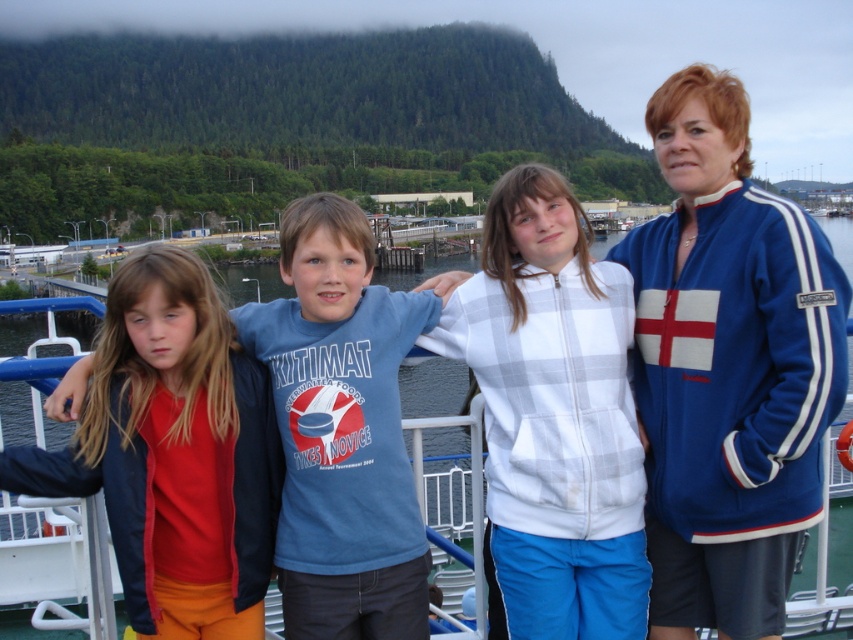
Question: Which of the following is the closest to the observer?

Choices:
 (A) blue cotton t-shirt at center
 (B) blue fabric boat at center
 (C) blue fleece jacket at right

Answer: (C)

Question: Which point is closer to the camera?

Choices:
 (A) blue fabric boat at center
 (B) blue cotton t-shirt at center
 (C) matte red shirt at left

Answer: (A)

Question: Which of the following is the closest to the observer?

Choices:
 (A) blue cotton t-shirt at center
 (B) blue fabric boat at center

Answer: (B)

Question: Is matte red shirt at left to the right of blue fabric boat at center from the viewer's perspective?

Choices:
 (A) no
 (B) yes

Answer: (A)

Question: Does matte red shirt at left have a greater width compared to blue fabric boat at center?

Choices:
 (A) yes
 (B) no

Answer: (B)

Question: Is blue fleece jacket at right bigger than matte red shirt at left?

Choices:
 (A) no
 (B) yes

Answer: (B)